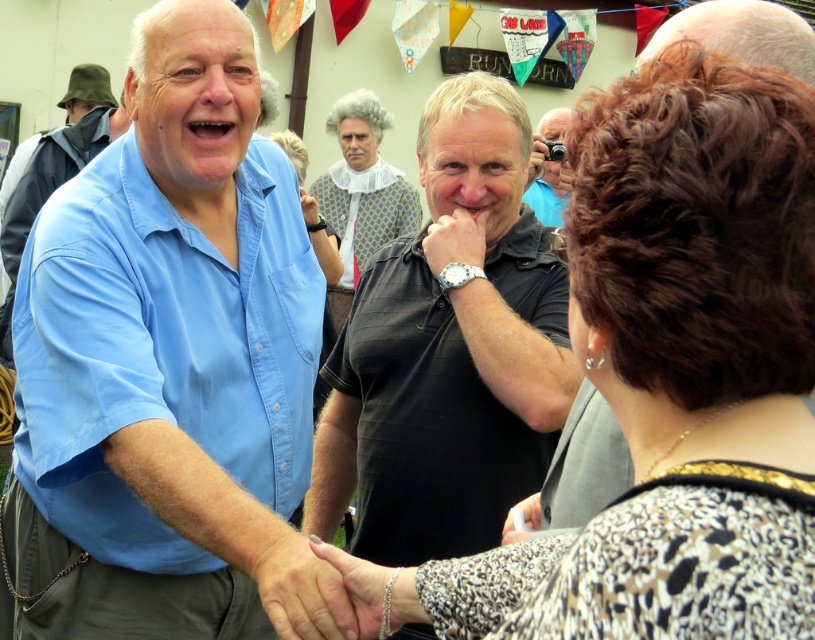
You are attending a party and want to take a photo of the blue cotton shirt at left and the leopard print blouse at center. Which one is lower in the image?

The blue cotton shirt at left is positioned under the leopard print blouse at center, so it is lower in the image.

What are the coordinates of the blue cotton shirt at left?

The coordinates of the blue cotton shirt at left are at point (170, 369).